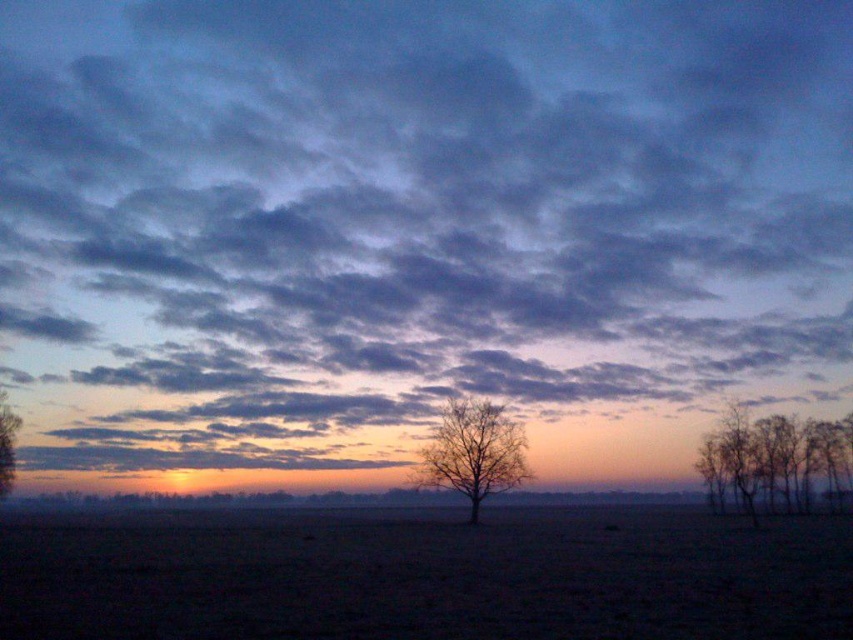
You are standing in the middle of the field looking towards the horizon. You see the dark soil at center and the bare branches at center. Which object is positioned to the left of the other?

The dark soil at center is to the left of the bare branches at center.

Looking at this image, you are standing in the middle of the open field and looking towards the horizon. Which object, the bare branches at right or the brown matte tree at left, is positioned more to your right side?

The bare branches at right are positioned more to your right side than the brown matte tree at left.